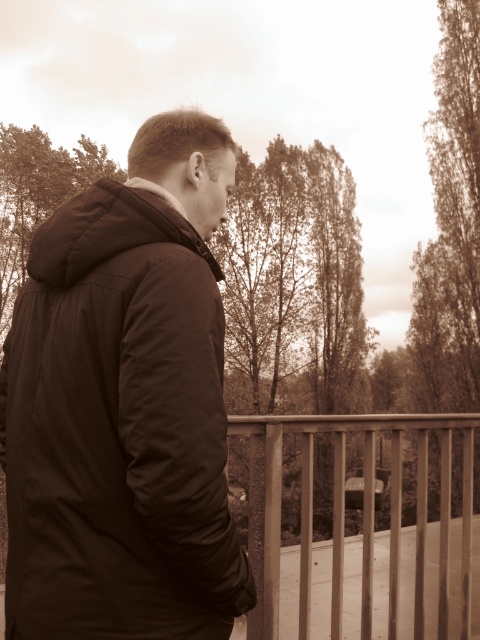
Is matte black jacket at center smaller than metallic silver fence at lower right?

Yes.

Consider the image. Which is above, matte black jacket at center or metallic silver fence at lower right?

matte black jacket at center is higher up.

Who is more forward, (115, 500) or (417, 586)?

Point (115, 500)

You are a GUI agent. You are given a task and a screenshot of the screen. Output one action in this format:
    pyautogui.click(x=<x>, y=<y>)
    Task: Click on the matte black jacket at center
    This screenshot has width=480, height=640.
    Given the screenshot: What is the action you would take?
    pyautogui.click(x=118, y=429)